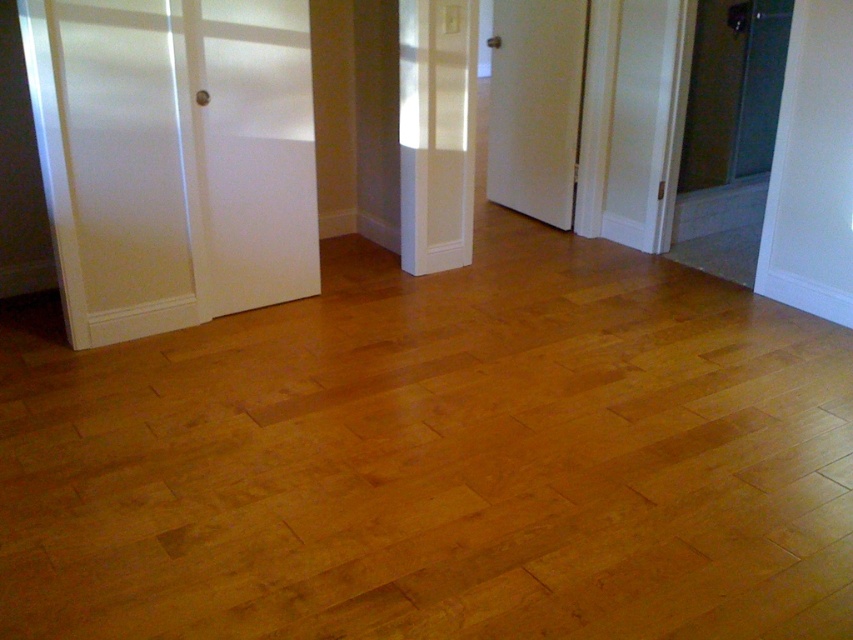
You are standing in the room and want to exit through the door on the far right. Which door should you approach first, the white glossy door at left or the white wood door at center?

The white glossy door at left is to the left of the white wood door at center, so to reach the door on the far right, you should approach the white wood door at center first.

You are standing in the room and want to exit through the door that is lower. Which door should you choose between the white glossy door at left and the white matte door at center?

The white glossy door at left is located below the white matte door at center, so you should choose the white glossy door at left as it is the lower one.